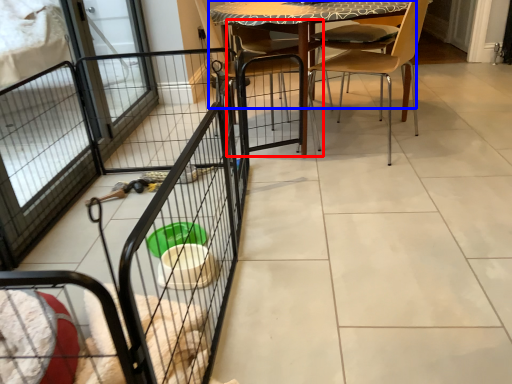
Question: Which of the following is the closest to the observer, armchair (highlighted by a red box) or table (highlighted by a blue box)?

Choices:
 (A) armchair
 (B) table

Answer: (B)